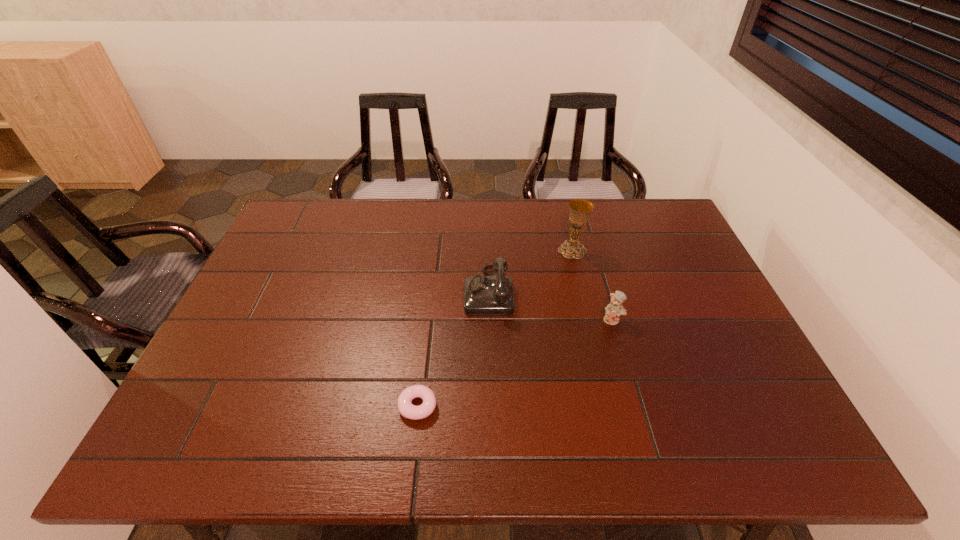
Find the location of a particular element. Image resolution: width=960 pixels, height=540 pixels. the tallest object is located at coordinates (580, 209).

Locate an element on the screen. the farthest object is located at coordinates (580, 209).

Find the location of `telephone`. telephone is located at coordinates (492, 295).

In order to click on teddy bear in this screenshot , I will do `click(615, 309)`.

Image resolution: width=960 pixels, height=540 pixels. Identify the location of doughnut. (405, 407).

Locate an element on the screen. Image resolution: width=960 pixels, height=540 pixels. the leftmost object is located at coordinates point(405,407).

You are a GUI agent. You are given a task and a screenshot of the screen. Output one action in this format:
    pyautogui.click(x=<x>, y=<y>)
    Task: Click on the free spot located 0.250m on the right of the chalice
    
    Given the screenshot: What is the action you would take?
    pyautogui.click(x=665, y=250)

The width and height of the screenshot is (960, 540). Find the location of `vacant space positioned on the dial of the telephone`. vacant space positioned on the dial of the telephone is located at coordinates (381, 291).

At what (x,y) coordinates should I click in order to perform the action: click on free space located 0.300m on the dial of the telephone. Please return your answer as a coordinate pair (x, y). Looking at the image, I should click on (360, 291).

This screenshot has width=960, height=540. Find the location of `free space located on the dial of the telephone`. free space located on the dial of the telephone is located at coordinates (402, 291).